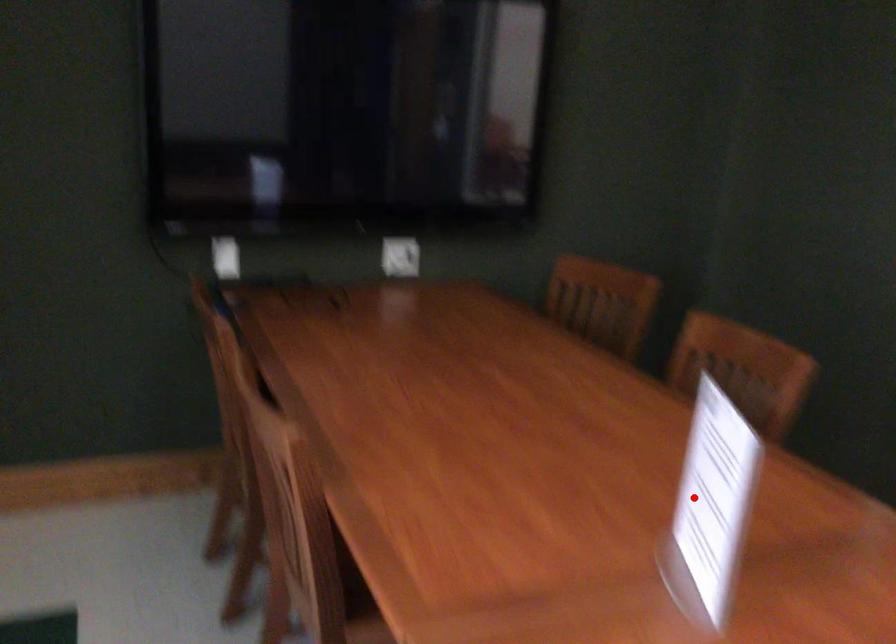
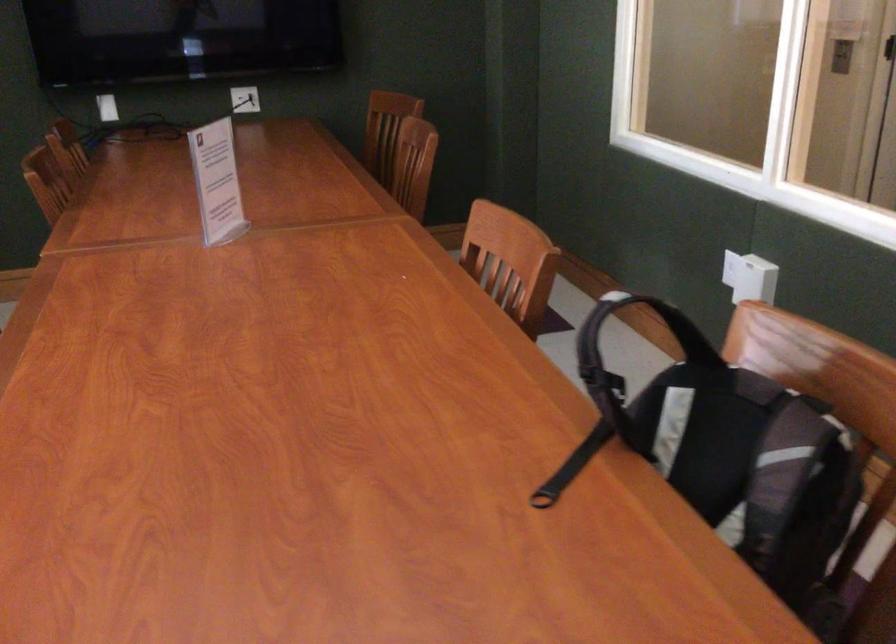
Locate, in the second image, the point that corresponds to the highlighted location in the first image.

(217, 182)